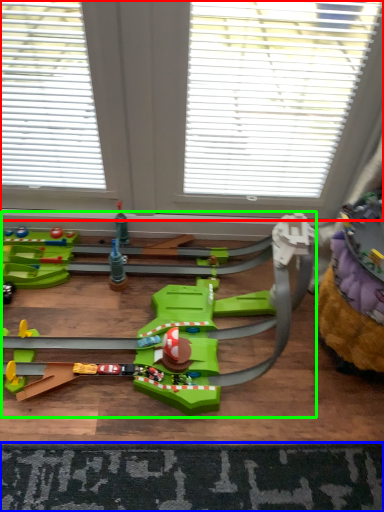
Question: Which object is positioned closest to window (highlighted by a red box)? Select from mat (highlighted by a blue box) and toy (highlighted by a green box).

Choices:
 (A) mat
 (B) toy

Answer: (B)